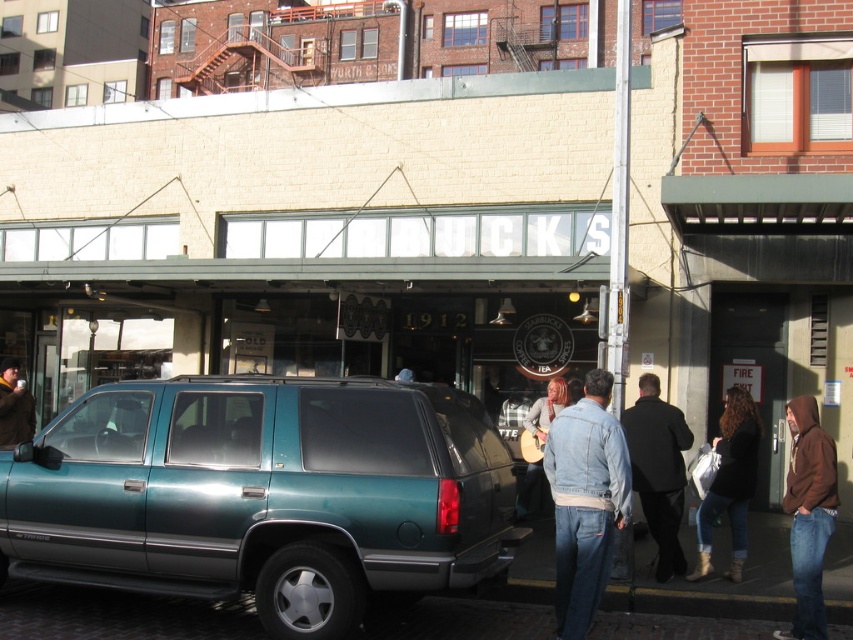
You are standing on the sidewalk in front of the Starbucks Coffee Tea store and notice two jackets hanging from the teal SUV parked nearby. Which jacket is closer to you, the denim jacket at lower right or the dark brown leather jacket at lower right?

The denim jacket at lower right is closer to the viewer than the dark brown leather jacket at lower right.

You are standing on the sidewalk in front of the Starbucks Coffee Tea store. You notice two points marked on the storefront. One is at coordinate point [659,548] and the other at point [18,372]. Which point is closer to you?

Point [659,548] is closer to the viewer than point [18,372].